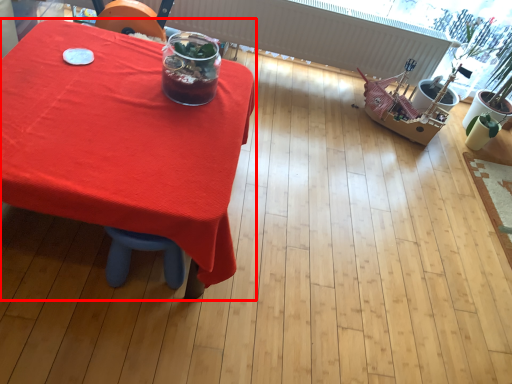
Question: From the image's perspective, what is the correct spatial positioning of table (annotated by the red box) in reference to drink?

Choices:
 (A) below
 (B) above

Answer: (A)